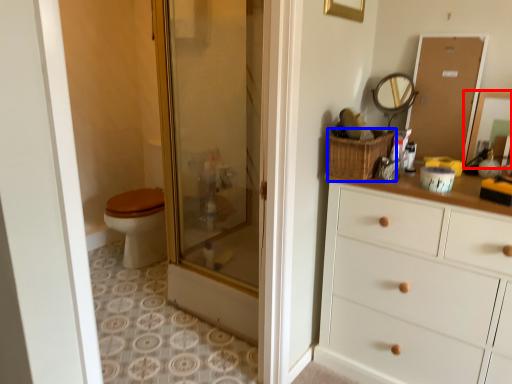
Question: Which point is closer to the camera, mirror (highlighted by a red box) or basket (highlighted by a blue box)?

Choices:
 (A) mirror
 (B) basket

Answer: (A)